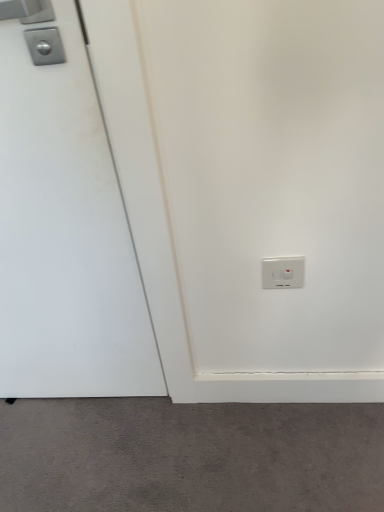
What is the approximate width of white matte door at left?

3.51 inches.

Measure the distance between white matte door at left and camera.

white matte door at left and camera are 23.64 inches apart from each other.

The height and width of the screenshot is (512, 384). In order to click on white matte door at left in this screenshot , I will do `click(63, 223)`.

Considering the points (4, 301) and (293, 267), which point is behind, point (4, 301) or point (293, 267)?

The point (4, 301) is behind.

Can you confirm if white matte door at left is smaller than white plastic power plugs and sockets at lower right?

Actually, white matte door at left might be larger than white plastic power plugs and sockets at lower right.

Considering the positions of objects white matte door at left and white plastic power plugs and sockets at lower right in the image provided, who is behind, white matte door at left or white plastic power plugs and sockets at lower right?

Positioned behind is white plastic power plugs and sockets at lower right.

Based on the photo, considering the relative positions of white matte door at left and gray matte carpet at lower center in the image provided, is white matte door at left to the left of gray matte carpet at lower center from the viewer's perspective?

Yes.

How different are the orientations of white matte door at left and gray matte carpet at lower center in degrees?

The facing directions of white matte door at left and gray matte carpet at lower center are 90.1 degrees apart.

Is white matte door at left aimed at gray matte carpet at lower center?

No.

At what (x,y) coordinates should I click in order to perform the action: click on concrete below the white matte door at left (from the image's perspective). Please return your answer as a coordinate pair (x, y). Looking at the image, I should click on (189, 456).

Is white plastic power plugs and sockets at lower right in front of white matte door at left?

No, the depth of white plastic power plugs and sockets at lower right is greater than that of white matte door at left.

Considering the positions of points (303, 283) and (70, 203), is point (303, 283) closer to camera compared to point (70, 203)?

No, it is not.

Is white plastic power plugs and sockets at lower right inside the boundaries of white matte door at left, or outside?

white plastic power plugs and sockets at lower right is not enclosed by white matte door at left.

Who is shorter, white plastic power plugs and sockets at lower right or white matte door at left?

Standing shorter between the two is white plastic power plugs and sockets at lower right.

Consider the image. Can you confirm if gray matte carpet at lower center is bigger than white plastic power plugs and sockets at lower right?

Indeed, gray matte carpet at lower center has a larger size compared to white plastic power plugs and sockets at lower right.

Is gray matte carpet at lower center oriented towards white plastic power plugs and sockets at lower right?

No, gray matte carpet at lower center does not turn towards white plastic power plugs and sockets at lower right.

How many degrees apart are the facing directions of gray matte carpet at lower center and white plastic power plugs and sockets at lower right?

89.8 degrees.

Considering the points (143, 500) and (266, 272), which point is in front, point (143, 500) or point (266, 272)?

The point (266, 272) is closer.

Is gray matte carpet at lower center taller or shorter than white matte door at left?

Clearly, gray matte carpet at lower center is shorter compared to white matte door at left.

Is gray matte carpet at lower center looking in the opposite direction of white matte door at left?

gray matte carpet at lower center is not turned away from white matte door at left.

Measure the distance between gray matte carpet at lower center and white matte door at left.

15.45 inches.

Considering the relative sizes of gray matte carpet at lower center and white matte door at left in the image provided, is gray matte carpet at lower center bigger than white matte door at left?

Actually, gray matte carpet at lower center might be smaller than white matte door at left.

From a real-world perspective, who is located lower, white plastic power plugs and sockets at lower right or gray matte carpet at lower center?

gray matte carpet at lower center is physically lower.

From the image's perspective, is white plastic power plugs and sockets at lower right above or below gray matte carpet at lower center?

white plastic power plugs and sockets at lower right is situated higher than gray matte carpet at lower center in the image.

Who is bigger, white plastic power plugs and sockets at lower right or gray matte carpet at lower center?

Bigger between the two is gray matte carpet at lower center.

This screenshot has width=384, height=512. Identify the location of door below the white plastic power plugs and sockets at lower right (from the image's perspective). (63, 223).

Image resolution: width=384 pixels, height=512 pixels. Identify the location of concrete on the right of the white matte door at left. point(189,456).

Considering their positions, is gray matte carpet at lower center positioned further to white plastic power plugs and sockets at lower right than white matte door at left?

gray matte carpet at lower center lies further to white plastic power plugs and sockets at lower right than the other object.

Which object lies nearer to the anchor point white matte door at left, white plastic power plugs and sockets at lower right or gray matte carpet at lower center?

gray matte carpet at lower center is closer to white matte door at left.

Looking at the image, which one is located closer to gray matte carpet at lower center, white matte door at left or white plastic power plugs and sockets at lower right?

white matte door at left is closer to gray matte carpet at lower center.

Estimate the real-world distances between objects in this image. Which object is further from white plastic power plugs and sockets at lower right, white matte door at left or gray matte carpet at lower center?

gray matte carpet at lower center is further to white plastic power plugs and sockets at lower right.

Considering their positions, is gray matte carpet at lower center positioned further to white matte door at left than white plastic power plugs and sockets at lower right?

Based on the image, white plastic power plugs and sockets at lower right appears to be further to white matte door at left.

Considering their positions, is white plastic power plugs and sockets at lower right positioned closer to gray matte carpet at lower center than white matte door at left?

The object closer to gray matte carpet at lower center is white matte door at left.

Where is `concrete between white matte door at left and white plastic power plugs and sockets at lower right`? This screenshot has width=384, height=512. concrete between white matte door at left and white plastic power plugs and sockets at lower right is located at coordinates (189, 456).